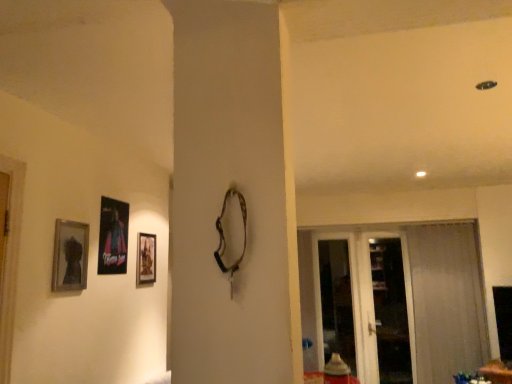
Question: Can you confirm if sheer white curtain at right is shorter than matte black picture frame at left, the first picture frame in the front-to-back sequence?

Choices:
 (A) no
 (B) yes

Answer: (A)

Question: Is sheer white curtain at right positioned with its back to matte black picture frame at left, the first picture frame in the front-to-back sequence?

Choices:
 (A) no
 (B) yes

Answer: (A)

Question: Is sheer white curtain at right to the left of matte black picture frame at left, the first picture frame in the front-to-back sequence, from the viewer's perspective?

Choices:
 (A) no
 (B) yes

Answer: (A)

Question: Does sheer white curtain at right have a greater height compared to matte black picture frame at left, which ranks as the 3th picture frame in right-to-left order?

Choices:
 (A) no
 (B) yes

Answer: (B)

Question: From a real-world perspective, is sheer white curtain at right located higher than matte black picture frame at left, acting as the first picture frame starting from the left?

Choices:
 (A) no
 (B) yes

Answer: (A)

Question: Is matte wooden picture frame at center, placed as the third picture frame when sorted from left to right, wider or thinner than transparent glass screen door at right, marked as the first screen door in a left-to-right arrangement?

Choices:
 (A) thin
 (B) wide

Answer: (A)

Question: Does point (146, 269) appear closer or farther from the camera than point (333, 347)?

Choices:
 (A) farther
 (B) closer

Answer: (B)

Question: From the image's perspective, is matte wooden picture frame at center, the first picture frame viewed from the back, located above or below transparent glass screen door at right, acting as the second screen door starting from the right?

Choices:
 (A) below
 (B) above

Answer: (B)

Question: Is matte wooden picture frame at center, placed as the third picture frame when sorted from left to right, taller or shorter than transparent glass screen door at right, acting as the second screen door starting from the right?

Choices:
 (A) tall
 (B) short

Answer: (B)

Question: From the image's perspective, relative to matte black picture frame at left, which ranks as the 3th picture frame in right-to-left order, is sheer white curtain at right above or below?

Choices:
 (A) below
 (B) above

Answer: (A)

Question: Is sheer white curtain at right wider or thinner than matte black picture frame at left, which is the 3th picture frame from back to front?

Choices:
 (A) thin
 (B) wide

Answer: (B)

Question: Would you say sheer white curtain at right is inside or outside matte black picture frame at left, the first picture frame in the front-to-back sequence?

Choices:
 (A) inside
 (B) outside

Answer: (B)

Question: In the image, is sheer white curtain at right on the left side or the right side of matte black picture frame at left, which ranks as the 3th picture frame in right-to-left order?

Choices:
 (A) left
 (B) right

Answer: (B)

Question: Is transparent glass screen door at right, the 2th screen door viewed from the left, situated inside metallic poster at left, placed as the 2th picture frame when sorted from back to front, or outside?

Choices:
 (A) outside
 (B) inside

Answer: (A)

Question: Considering the positions of transparent glass screen door at right, the 2th screen door viewed from the left, and metallic poster at left, the second picture frame viewed from the left, in the image, is transparent glass screen door at right, the 2th screen door viewed from the left, bigger or smaller than metallic poster at left, the second picture frame viewed from the left,?

Choices:
 (A) big
 (B) small

Answer: (A)